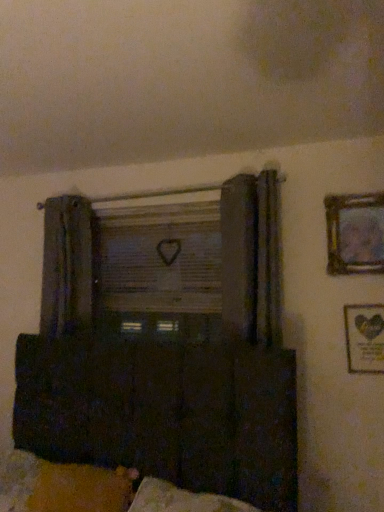
Measure the distance between wooden window screen at center and camera.

wooden window screen at center is 2.33 meters from camera.

Find the location of a particular element. The image size is (384, 512). wooden framed picture at lower right, which is counted as the first picture frame, starting from the bottom is located at coordinates (364, 338).

How much space does wooden picture frame at upper right, marked as the second picture frame in a bottom-to-top arrangement, occupy vertically?

It is 14.92 inches.

Describe the element at coordinates (164, 412) in the screenshot. I see `dark wood cabinet at lower center` at that location.

This screenshot has width=384, height=512. I want to click on wooden window screen at center, so click(x=159, y=258).

Does wooden framed picture at lower right, placed as the 2th picture frame when sorted from top to bottom, have a greater width compared to dark wood cabinet at lower center?

No, wooden framed picture at lower right, placed as the 2th picture frame when sorted from top to bottom, is not wider than dark wood cabinet at lower center.

Does wooden framed picture at lower right, placed as the 2th picture frame when sorted from top to bottom, have a smaller size compared to dark wood cabinet at lower center?

Correct, wooden framed picture at lower right, placed as the 2th picture frame when sorted from top to bottom, occupies less space than dark wood cabinet at lower center.

From the image's perspective, is wooden framed picture at lower right, placed as the 2th picture frame when sorted from top to bottom, above dark wood cabinet at lower center?

Yes, from the image's perspective, wooden framed picture at lower right, placed as the 2th picture frame when sorted from top to bottom, is on top of dark wood cabinet at lower center.

This screenshot has width=384, height=512. In the image, there is a wooden framed picture at lower right, placed as the 2th picture frame when sorted from top to bottom. In order to click on furniture below it (from the image's perspective) in this screenshot , I will do `click(164, 412)`.

From the image's perspective, is wooden framed picture at lower right, placed as the 2th picture frame when sorted from top to bottom, on velvety yellow pillow at lower left?

Yes, from the image's perspective, wooden framed picture at lower right, placed as the 2th picture frame when sorted from top to bottom, is on top of velvety yellow pillow at lower left.

Considering the sizes of objects wooden framed picture at lower right, which is counted as the first picture frame, starting from the bottom, and velvety yellow pillow at lower left in the image provided, who is shorter, wooden framed picture at lower right, which is counted as the first picture frame, starting from the bottom, or velvety yellow pillow at lower left?

velvety yellow pillow at lower left.

Is wooden framed picture at lower right, placed as the 2th picture frame when sorted from top to bottom, touching velvety yellow pillow at lower left?

No.

Consider the image. Based on their sizes in the image, would you say wooden framed picture at lower right, placed as the 2th picture frame when sorted from top to bottom, is bigger or smaller than velvety yellow pillow at lower left?

wooden framed picture at lower right, placed as the 2th picture frame when sorted from top to bottom, is smaller than velvety yellow pillow at lower left.

From the image's perspective, is velvety yellow pillow at lower left positioned above or below wooden picture frame at upper right, arranged as the first picture frame when viewed from the top?

Clearly, from the image's perspective, velvety yellow pillow at lower left is below wooden picture frame at upper right, arranged as the first picture frame when viewed from the top.

Is the surface of velvety yellow pillow at lower left in direct contact with wooden picture frame at upper right, arranged as the first picture frame when viewed from the top?

No, velvety yellow pillow at lower left is not beside wooden picture frame at upper right, arranged as the first picture frame when viewed from the top.

Which of these two, velvety yellow pillow at lower left or wooden picture frame at upper right, arranged as the first picture frame when viewed from the top, is thinner?

With smaller width is wooden picture frame at upper right, arranged as the first picture frame when viewed from the top.

You are a GUI agent. You are given a task and a screenshot of the screen. Output one action in this format:
    pyautogui.click(x=<x>, y=<y>)
    Task: Click on the pillow lying on the left of wooden picture frame at upper right, marked as the second picture frame in a bottom-to-top arrangement
    Image resolution: width=384 pixels, height=512 pixels.
    Given the screenshot: What is the action you would take?
    click(x=81, y=489)

Is dark wood cabinet at lower center thinner than wooden picture frame at upper right, marked as the second picture frame in a bottom-to-top arrangement?

In fact, dark wood cabinet at lower center might be wider than wooden picture frame at upper right, marked as the second picture frame in a bottom-to-top arrangement.

Is dark wood cabinet at lower center surrounding wooden picture frame at upper right, arranged as the first picture frame when viewed from the top?

Actually, wooden picture frame at upper right, arranged as the first picture frame when viewed from the top, is outside dark wood cabinet at lower center.

Is dark wood cabinet at lower center positioned with its back to wooden picture frame at upper right, arranged as the first picture frame when viewed from the top?

No, dark wood cabinet at lower center is not facing away from wooden picture frame at upper right, arranged as the first picture frame when viewed from the top.

Does dark wood cabinet at lower center touch wooden picture frame at upper right, arranged as the first picture frame when viewed from the top?

No, dark wood cabinet at lower center is not next to wooden picture frame at upper right, arranged as the first picture frame when viewed from the top.

The height and width of the screenshot is (512, 384). In order to click on furniture beneath the wooden framed picture at lower right, placed as the 2th picture frame when sorted from top to bottom (from a real-world perspective) in this screenshot , I will do `click(164, 412)`.

From the image's perspective, is dark wood cabinet at lower center located beneath wooden framed picture at lower right, placed as the 2th picture frame when sorted from top to bottom?

Yes, from the image's perspective, dark wood cabinet at lower center is beneath wooden framed picture at lower right, placed as the 2th picture frame when sorted from top to bottom.

Is dark wood cabinet at lower center positioned before wooden framed picture at lower right, which is counted as the first picture frame, starting from the bottom?

Yes.

Which of these two, dark wood cabinet at lower center or wooden window screen at center, stands taller?

Standing taller between the two is wooden window screen at center.

Does dark wood cabinet at lower center have a smaller size compared to wooden window screen at center?

Incorrect, dark wood cabinet at lower center is not smaller in size than wooden window screen at center.

From the image's perspective, which one is positioned higher, dark wood cabinet at lower center or wooden window screen at center?

wooden window screen at center is shown above in the image.

Is dark wood cabinet at lower center positioned behind wooden window screen at center?

No, it is not.

Is dark wood cabinet at lower center at the back of velvety yellow pillow at lower left?

Correct, velvety yellow pillow at lower left is looking away from dark wood cabinet at lower center.

Would you say velvety yellow pillow at lower left is to the left or to the right of dark wood cabinet at lower center in the picture?

From the image, it's evident that velvety yellow pillow at lower left is to the left of dark wood cabinet at lower center.

From a real-world perspective, is velvety yellow pillow at lower left positioned under dark wood cabinet at lower center based on gravity?

Indeed, from a real-world perspective, velvety yellow pillow at lower left is positioned beneath dark wood cabinet at lower center.

Who is more distant, velvety yellow pillow at lower left or dark wood cabinet at lower center?

velvety yellow pillow at lower left.

In order to click on the 2nd picture frame behind the dark wood cabinet at lower center in this screenshot , I will do `click(364, 338)`.

At what (x,y) coordinates should I click in order to perform the action: click on pillow that is on the left side of wooden framed picture at lower right, which is counted as the first picture frame, starting from the bottom. Please return your answer as a coordinate pair (x, y). The height and width of the screenshot is (512, 384). Looking at the image, I should click on (81, 489).

From the image, which object appears to be farther from dark wood cabinet at lower center, wooden framed picture at lower right, which is counted as the first picture frame, starting from the bottom, or wooden window screen at center?

wooden framed picture at lower right, which is counted as the first picture frame, starting from the bottom, is further to dark wood cabinet at lower center.

When comparing their distances from wooden framed picture at lower right, placed as the 2th picture frame when sorted from top to bottom, does wooden window screen at center or wooden picture frame at upper right, arranged as the first picture frame when viewed from the top, seem closer?

Among the two, wooden picture frame at upper right, arranged as the first picture frame when viewed from the top, is located nearer to wooden framed picture at lower right, placed as the 2th picture frame when sorted from top to bottom.

Considering their positions, is wooden picture frame at upper right, marked as the second picture frame in a bottom-to-top arrangement, positioned further to wooden window screen at center than wooden framed picture at lower right, placed as the 2th picture frame when sorted from top to bottom?

Among the two, wooden framed picture at lower right, placed as the 2th picture frame when sorted from top to bottom, is located further to wooden window screen at center.

Consider the image. Considering their positions, is wooden window screen at center positioned closer to wooden framed picture at lower right, which is counted as the first picture frame, starting from the bottom, than dark wood cabinet at lower center?

Based on the image, dark wood cabinet at lower center appears to be nearer to wooden framed picture at lower right, which is counted as the first picture frame, starting from the bottom.

From the image, which object appears to be farther from wooden framed picture at lower right, placed as the 2th picture frame when sorted from top to bottom, velvety yellow pillow at lower left or dark wood cabinet at lower center?

velvety yellow pillow at lower left is positioned further to the anchor wooden framed picture at lower right, placed as the 2th picture frame when sorted from top to bottom.

Based on their spatial positions, is velvety yellow pillow at lower left or dark wood cabinet at lower center closer to wooden picture frame at upper right, arranged as the first picture frame when viewed from the top?

dark wood cabinet at lower center is positioned closer to the anchor wooden picture frame at upper right, arranged as the first picture frame when viewed from the top.

From the image, which object appears to be farther from velvety yellow pillow at lower left, wooden picture frame at upper right, arranged as the first picture frame when viewed from the top, or wooden window screen at center?

Among the two, wooden picture frame at upper right, arranged as the first picture frame when viewed from the top, is located further to velvety yellow pillow at lower left.

Estimate the real-world distances between objects in this image. Which object is closer to wooden picture frame at upper right, marked as the second picture frame in a bottom-to-top arrangement, velvety yellow pillow at lower left or wooden framed picture at lower right, which is counted as the first picture frame, starting from the bottom?

wooden framed picture at lower right, which is counted as the first picture frame, starting from the bottom.

In order to click on window screen between velvety yellow pillow at lower left and wooden picture frame at upper right, arranged as the first picture frame when viewed from the top, in the horizontal direction in this screenshot , I will do pos(159,258).

The height and width of the screenshot is (512, 384). Identify the location of pillow positioned between dark wood cabinet at lower center and wooden framed picture at lower right, which is counted as the first picture frame, starting from the bottom, from near to far. (81, 489).

Where is `picture frame between velvety yellow pillow at lower left and wooden framed picture at lower right, which is counted as the first picture frame, starting from the bottom, in the horizontal direction`? The image size is (384, 512). picture frame between velvety yellow pillow at lower left and wooden framed picture at lower right, which is counted as the first picture frame, starting from the bottom, in the horizontal direction is located at coordinates (355, 233).

Find the location of `picture frame between dark wood cabinet at lower center and wooden framed picture at lower right, placed as the 2th picture frame when sorted from top to bottom, along the z-axis`. picture frame between dark wood cabinet at lower center and wooden framed picture at lower right, placed as the 2th picture frame when sorted from top to bottom, along the z-axis is located at coordinates (355, 233).